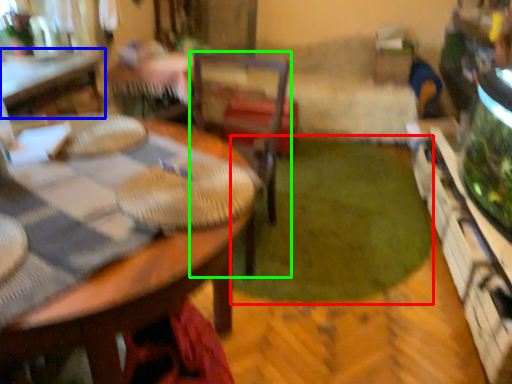
Question: Which object is the closest to the grass (highlighted by a red box)? Choose among these: table (highlighted by a blue box) or chair (highlighted by a green box).

Choices:
 (A) table
 (B) chair

Answer: (B)